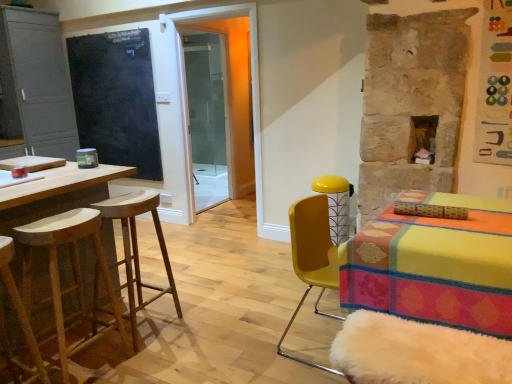
The height and width of the screenshot is (384, 512). In order to click on vacant location below wooden bar stool at left, arranged as the 1th stool when viewed from the back (from a real-world perspective) in this screenshot , I will do `click(148, 323)`.